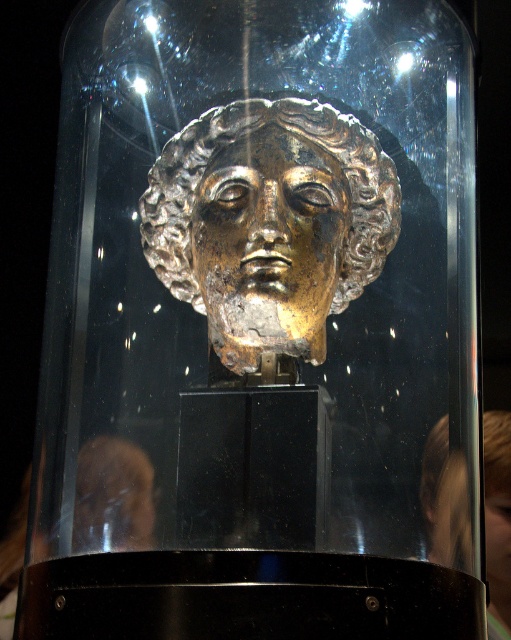
Question: Which of the following is the closest to the observer?

Choices:
 (A) (509, 483)
 (B) (330, 204)

Answer: (B)

Question: Considering the relative positions of gold/gilded bronze head at center and gold metallic head at center in the image provided, where is gold/gilded bronze head at center located with respect to gold metallic head at center?

Choices:
 (A) left
 (B) right

Answer: (A)

Question: Is gold/gilded metallic bust at center thinner than gold metallic head at center?

Choices:
 (A) no
 (B) yes

Answer: (A)

Question: Does gold/gilded metallic bust at center come in front of gold metallic head at center?

Choices:
 (A) yes
 (B) no

Answer: (B)

Question: Which of the following is the closest to the observer?

Choices:
 (A) (241, 273)
 (B) (260, 200)
 (C) (487, 428)

Answer: (A)

Question: Which of the following is the farthest from the observer?

Choices:
 (A) (273, 204)
 (B) (227, 310)

Answer: (B)